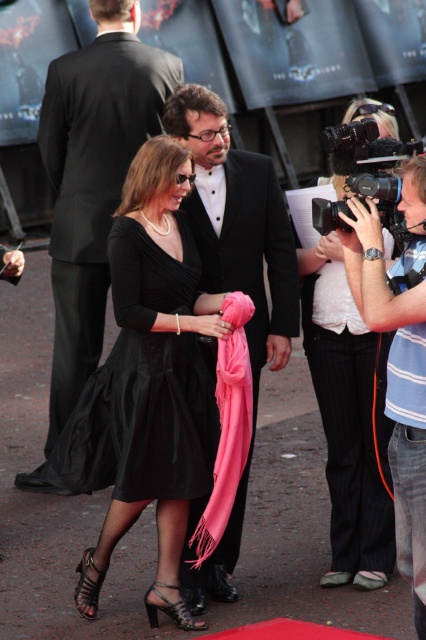
You are at a red carpet event and see two points marked in the scene. The first point is located at coordinates point (124,150) and the second is at point (143,476). Which point is closer to you?

Point (124,150) is closer to you because it is further to the camera than point (143,476).

You are a photographer at the event and want to capture both the shiny black suit at center and the satin black dress at center in a single frame. Which object should you adjust your camera angle to focus on first to ensure both are visible?

The satin black dress at center is behind the shiny black suit at center, so you should focus on the shiny black suit at center first to ensure the dress behind it is also in the frame.